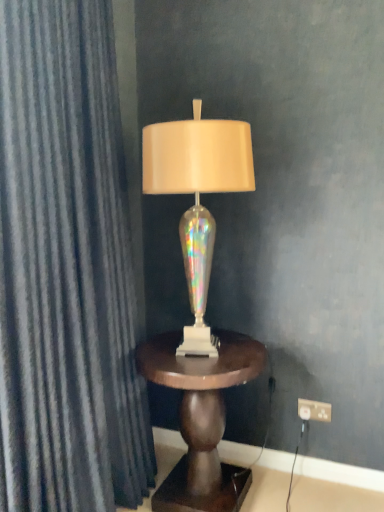
Question: Visually, is dark blue textured curtain at left positioned to the left or to the right of white plastic outlet at lower right?

Choices:
 (A) right
 (B) left

Answer: (B)

Question: Is dark blue textured curtain at left in front of or behind white plastic outlet at lower right in the image?

Choices:
 (A) front
 (B) behind

Answer: (A)

Question: Estimate the real-world distances between objects in this image. Which object is farther from the iridescent glass lamp at center?

Choices:
 (A) white plastic outlet at lower right
 (B) mahogany wood side table at center
 (C) dark blue textured curtain at left

Answer: (A)

Question: Considering the real-world distances, which object is closest to the iridescent glass lamp at center?

Choices:
 (A) white plastic outlet at lower right
 (B) mahogany wood side table at center
 (C) dark blue textured curtain at left

Answer: (C)